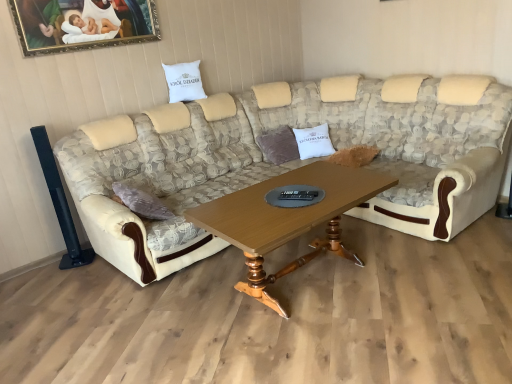
Question: Should I look upward or downward to see white fabric pillow at upper center, the 1th pillow when ordered from top to bottom?

Choices:
 (A) up
 (B) down

Answer: (A)

Question: Is white cotton pillow at center, placed as the 1th pillow when sorted from right to left, oriented away from gold-framed painting at upper left?

Choices:
 (A) no
 (B) yes

Answer: (A)

Question: From the image's perspective, does white cotton pillow at center, the first pillow positioned from the bottom, appear higher than gold-framed painting at upper left?

Choices:
 (A) no
 (B) yes

Answer: (A)

Question: Is white cotton pillow at center, placed as the second pillow when sorted from top to bottom, behind gold-framed painting at upper left?

Choices:
 (A) no
 (B) yes

Answer: (B)

Question: Considering the relative positions of white cotton pillow at center, the first pillow positioned from the bottom, and gold-framed painting at upper left in the image provided, is white cotton pillow at center, the first pillow positioned from the bottom, to the right of gold-framed painting at upper left from the viewer's perspective?

Choices:
 (A) yes
 (B) no

Answer: (A)

Question: From a real-world perspective, is white cotton pillow at center, the first pillow positioned from the bottom, positioned over gold-framed painting at upper left based on gravity?

Choices:
 (A) no
 (B) yes

Answer: (A)

Question: Is white cotton pillow at center, placed as the 1th pillow when sorted from right to left, thinner than gold-framed painting at upper left?

Choices:
 (A) no
 (B) yes

Answer: (A)

Question: From a real-world perspective, is beige fabric couch at center on gold-framed painting at upper left?

Choices:
 (A) yes
 (B) no

Answer: (B)

Question: Is beige fabric couch at center at the right side of gold-framed painting at upper left?

Choices:
 (A) no
 (B) yes

Answer: (B)

Question: Can you confirm if beige fabric couch at center is taller than gold-framed painting at upper left?

Choices:
 (A) yes
 (B) no

Answer: (A)

Question: Could gold-framed painting at upper left be considered to be inside beige fabric couch at center?

Choices:
 (A) no
 (B) yes

Answer: (A)

Question: Is beige fabric couch at center to the left of gold-framed painting at upper left from the viewer's perspective?

Choices:
 (A) no
 (B) yes

Answer: (A)

Question: Is beige fabric couch at center shorter than gold-framed painting at upper left?

Choices:
 (A) no
 (B) yes

Answer: (A)

Question: Can you confirm if woodenwoodencoffee table at center is smaller than gold-framed painting at upper left?

Choices:
 (A) no
 (B) yes

Answer: (A)